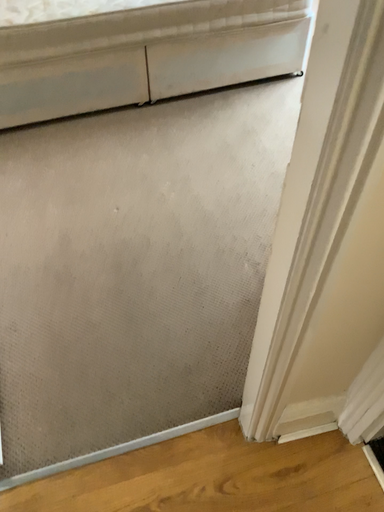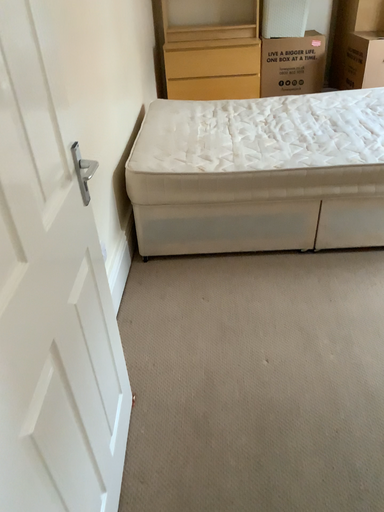
Question: How did the camera likely rotate when shooting the video?

Choices:
 (A) rotated right
 (B) rotated left

Answer: (B)